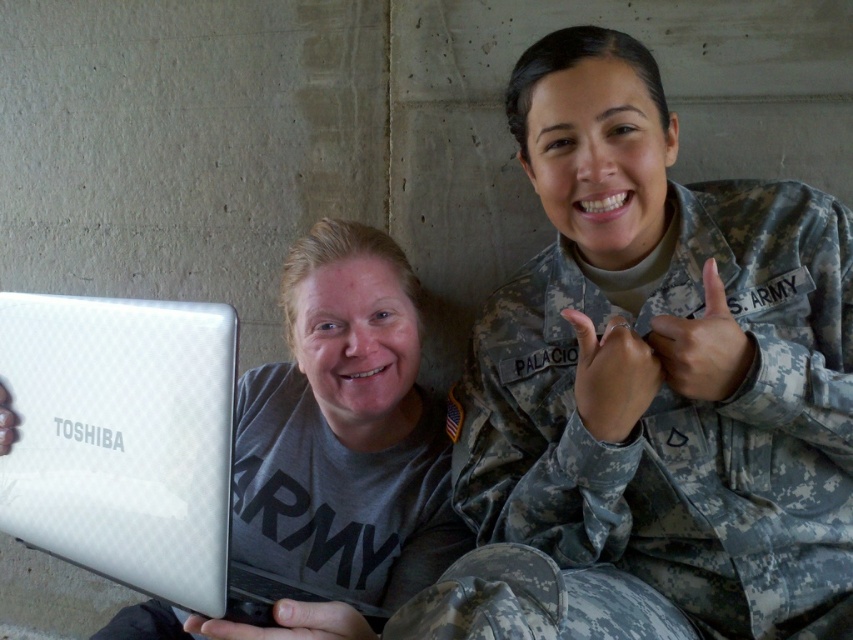
Question: Which point is closer to the camera taking this photo?

Choices:
 (A) (132, 572)
 (B) (548, 301)

Answer: (A)

Question: Is camouflage fabric us army uniform at upper right thinner than silver textured laptop at center?

Choices:
 (A) yes
 (B) no

Answer: (B)

Question: Considering the relative positions of camouflage fabric us army uniform at upper right and silver textured laptop at center in the image provided, where is camouflage fabric us army uniform at upper right located with respect to silver textured laptop at center?

Choices:
 (A) below
 (B) above

Answer: (B)

Question: Which point is closer to the camera?

Choices:
 (A) (718, 259)
 (B) (280, 584)

Answer: (A)

Question: Does camouflage fabric us army uniform at upper right have a lesser width compared to silver textured laptop at center?

Choices:
 (A) no
 (B) yes

Answer: (A)

Question: Among these objects, which one is farthest from the camera?

Choices:
 (A) silver textured laptop at center
 (B) camouflage fabric us army uniform at upper right

Answer: (A)